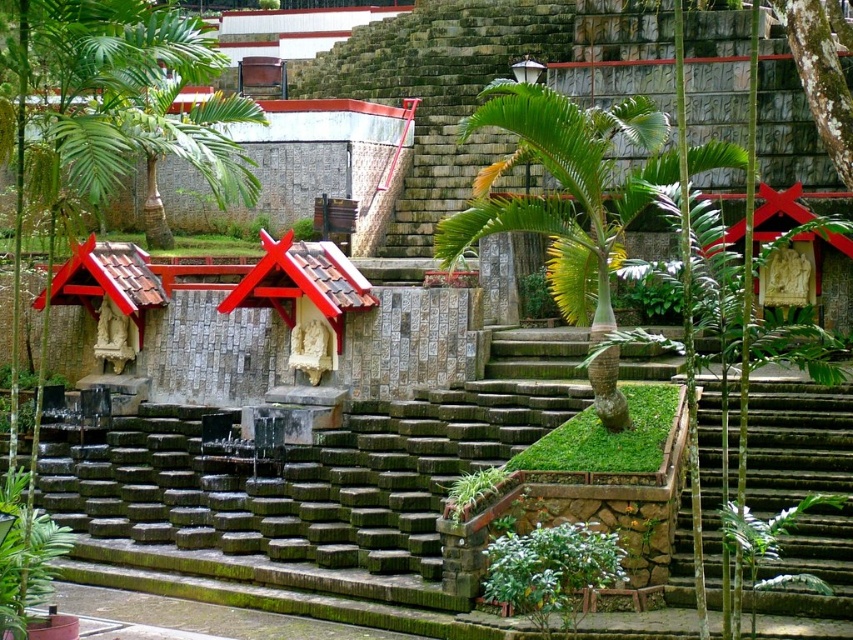
Is green leafy tree at center taller than green stone stairs at lower right?

Yes.

Does green leafy tree at center have a lesser height compared to green stone stairs at lower right?

In fact, green leafy tree at center may be taller than green stone stairs at lower right.

Between point (490, 186) and point (801, 554), which one is positioned behind?

The point (490, 186) is behind.

Where is `green leafy tree at center`? green leafy tree at center is located at coordinates (564, 189).

Does green stone stairs at lower right come in front of green mossy bark tree at upper center?

No, green stone stairs at lower right is further to the viewer.

Does green stone stairs at lower right have a larger size compared to green mossy bark tree at upper center?

Yes, green stone stairs at lower right is bigger than green mossy bark tree at upper center.

The height and width of the screenshot is (640, 853). Describe the element at coordinates (796, 442) in the screenshot. I see `green stone stairs at lower right` at that location.

Locate an element on the screen. green stone stairs at lower right is located at coordinates (796, 442).

Does green leafy tree at center have a lesser height compared to green mossy bark tree at upper center?

No.

Is point (532, 156) in front of point (804, 65)?

No, (532, 156) is further to viewer.

At what (x,y) coordinates should I click in order to perform the action: click on green leafy tree at center. Please return your answer as a coordinate pair (x, y). The width and height of the screenshot is (853, 640). Looking at the image, I should click on (564, 189).